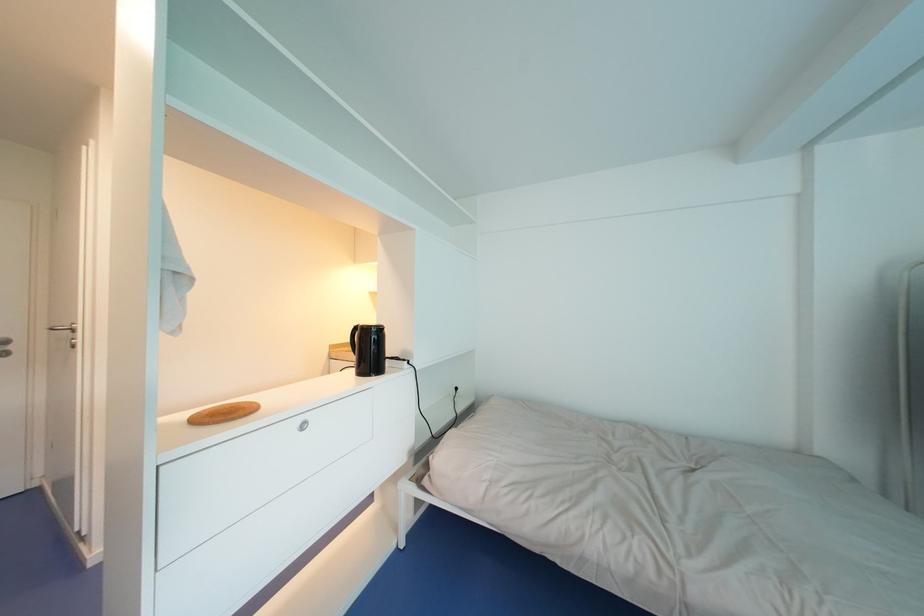
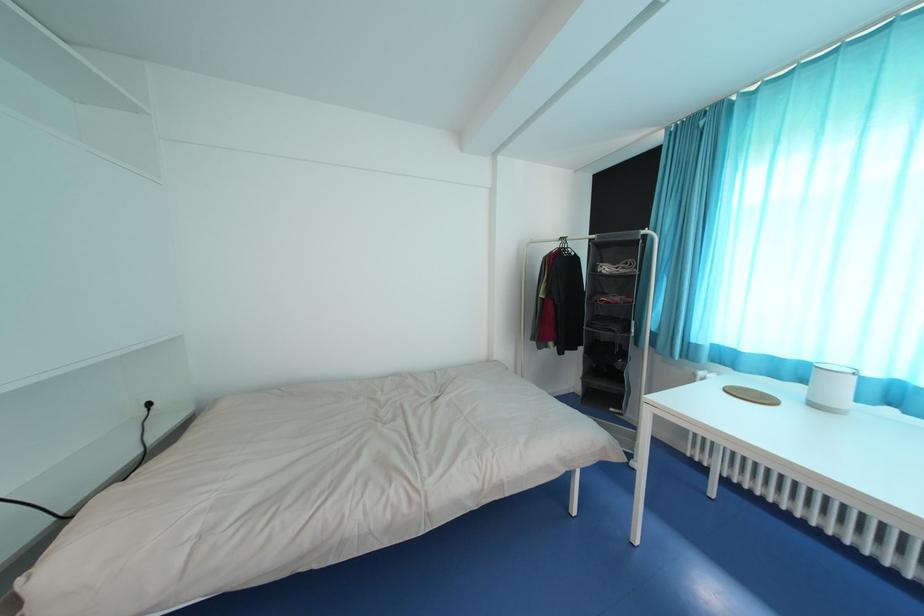
Question: The camera is either moving clockwise (left) or counter-clockwise (right) around the object. The first image is from the beginning of the video and the second image is from the end. Is the camera moving left or right when shooting the video?

Choices:
 (A) Left
 (B) Right

Answer: (A)